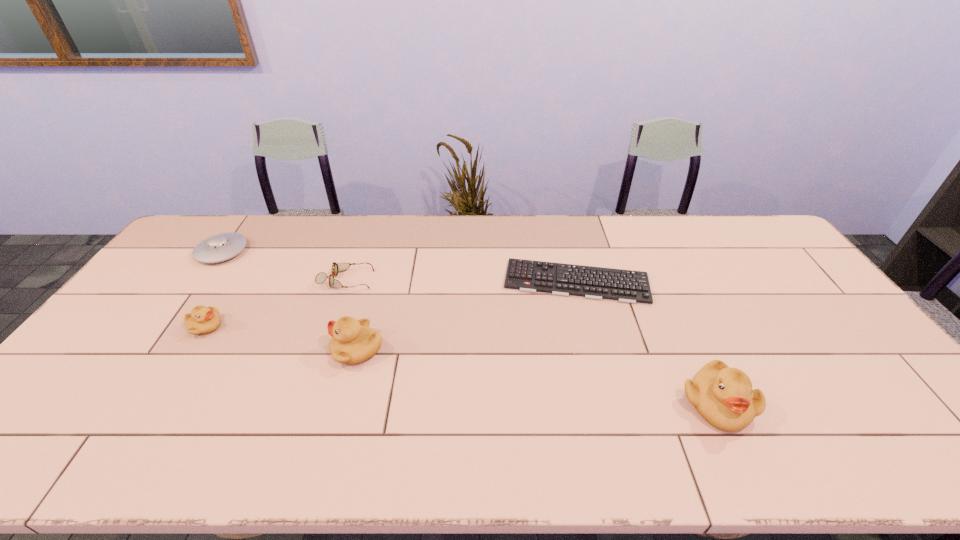
You are a GUI agent. You are given a task and a screenshot of the screen. Output one action in this format:
    pyautogui.click(x=<x>, y=<y>)
    Task: Click on the empty space between the second duckling from right to left and the spectacles
    This screenshot has width=960, height=540.
    Given the screenshot: What is the action you would take?
    pyautogui.click(x=352, y=315)

Locate an element on the screen. This screenshot has height=540, width=960. empty space between the second duckling from left to right and the third shortest object is located at coordinates (290, 300).

I want to click on vacant region between the second shortest object and the rightmost duckling, so click(x=532, y=342).

Locate an element on the screen. free area in between the fourth tallest object and the second duckling from left to right is located at coordinates (290, 300).

Locate an element on the screen. free space between the nearest duckling and the spectacles is located at coordinates (532, 342).

Identify which object is the fourth closest to the second tallest object. Please provide its 2D coordinates. Your answer should be formatted as a tuple, i.e. [(x, y)], where the tuple contains the x and y coordinates of a point satisfying the conditions above.

[(220, 247)]

This screenshot has height=540, width=960. Identify the location of the fourth closest object to the leftmost duckling. (627, 286).

At what (x,y) coordinates should I click in order to perform the action: click on the second closest duckling to the rightmost duckling. Please return your answer as a coordinate pair (x, y). The width and height of the screenshot is (960, 540). Looking at the image, I should click on (202, 320).

Where is `duckling that is the third closest to the fifth tallest object`? The height and width of the screenshot is (540, 960). duckling that is the third closest to the fifth tallest object is located at coordinates [x=723, y=396].

Find the location of a particular element. vacant space that satisfies the following two spatial constraints: 1. on the front side of the shortest object; 2. on the front-facing side of the third tallest object is located at coordinates (588, 327).